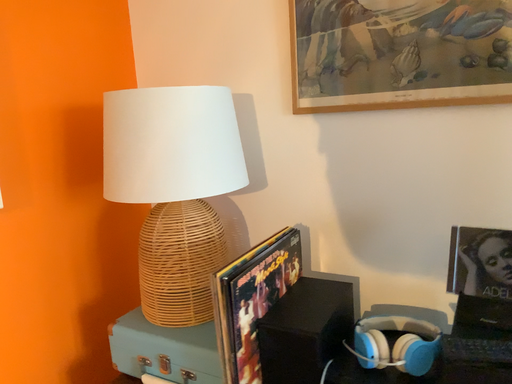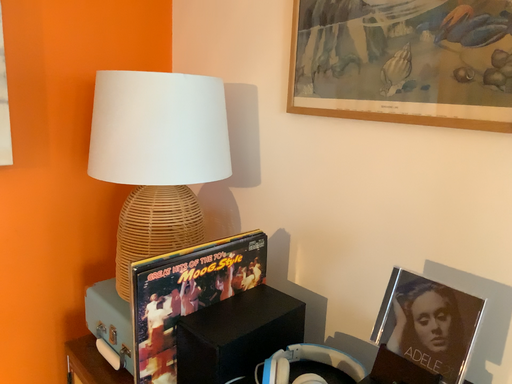
Question: Which way did the camera rotate in the video?

Choices:
 (A) rotated left
 (B) rotated right

Answer: (A)